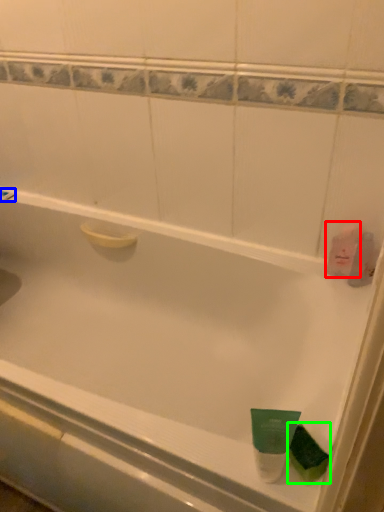
Question: Considering the real-world distances, which object is farthest from mouthwash (highlighted by a red box)? shower (highlighted by a blue box) or mouthwash (highlighted by a green box)?

Choices:
 (A) shower
 (B) mouthwash

Answer: (A)